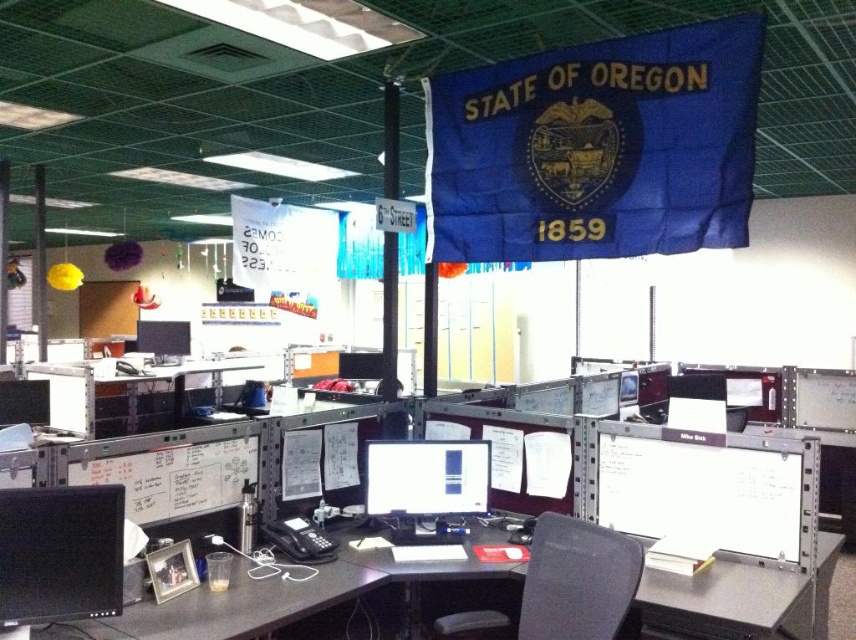
You are an office worker who needs to choose a monitor for a presentation. You want to use the larger one. Which matte black monitor should you choose between the matte black monitor at center and the matte black monitor at upper left?

The matte black monitor at upper left is larger than the matte black monitor at center, so you should choose the matte black monitor at upper left for your presentation.

You are an office worker who needs to place a 12 inch tall document on the white paperboard at right and the black fabric swivel chair at center. Which object can accommodate the document without it exceeding its height?

The black fabric swivel chair at center can accommodate the 12 inch tall document since the white paperboard at right has a lesser height compared to it.

You are standing in the office cubicle area and want to determine which of the two points, point [816,528] or point [615,604], is closer to you. Based on the scene description, which point is nearer?

Point [816,528] is further to the viewer than point [615,604], so the closer point is point [615,604].